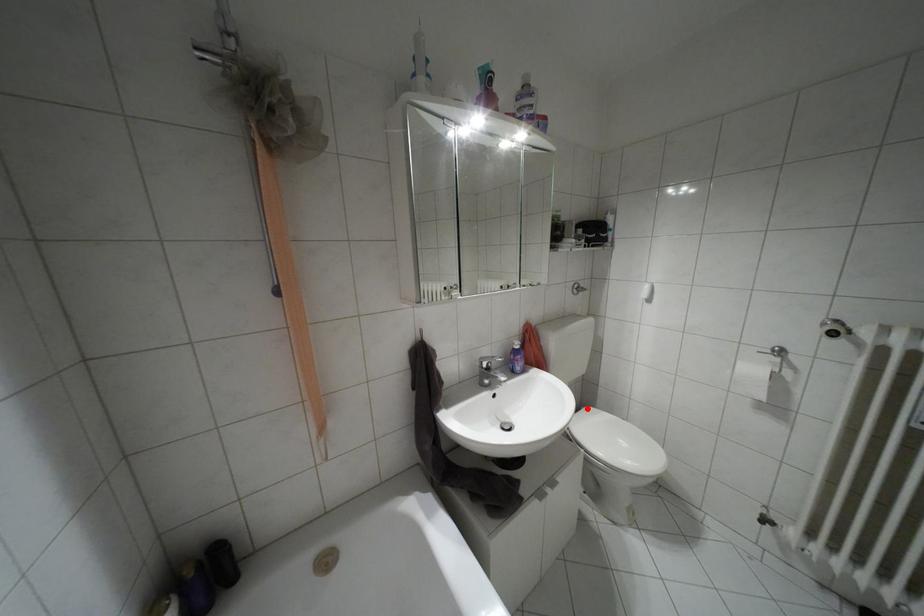
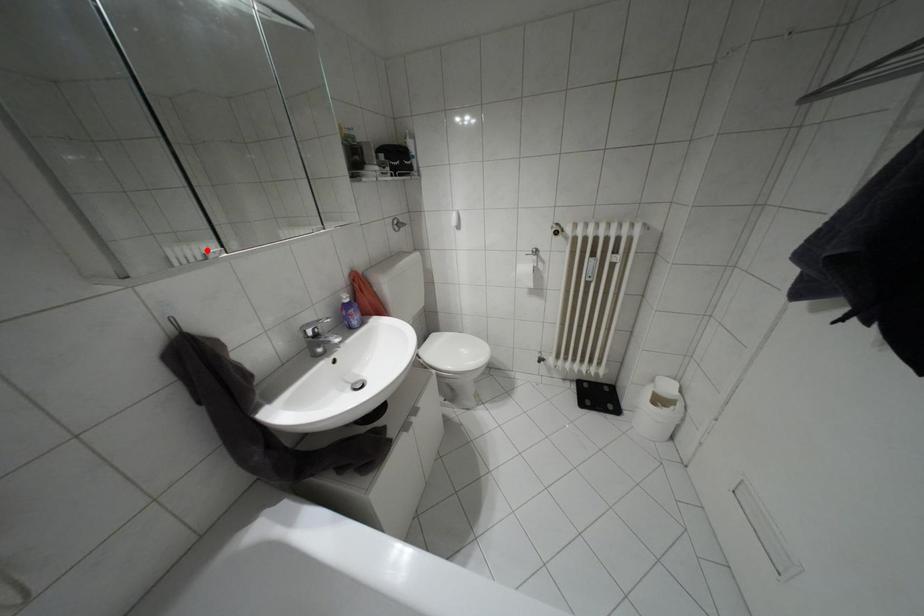
I am providing you with two images of the same scene from different viewpoints. A red point is marked on the first image and another point is marked on the second image. Do the highlighted points in image1 and image2 indicate the same real-world spot?

No